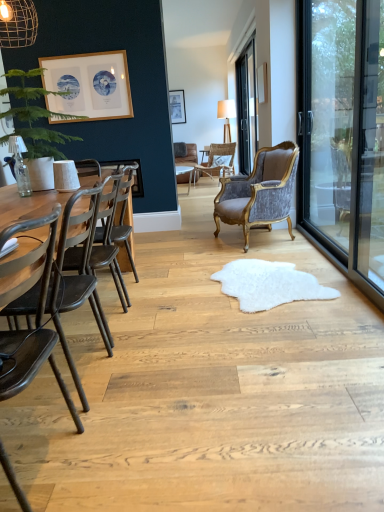
Question: Relative to matte wooden picture frame at center, the second picture frame from the right, is white fluffy rug at center in front or behind?

Choices:
 (A) behind
 (B) front

Answer: (B)

Question: Is white fluffy rug at center to the left or to the right of matte wooden picture frame at center, which appears as the 1th picture frame when viewed from the back, in the image?

Choices:
 (A) right
 (B) left

Answer: (A)

Question: Estimate the real-world distances between objects in this image. Which object is farther from the white fluffy rug at center?

Choices:
 (A) wooden textured lamp at center, the first lamp positioned from the back
 (B) dark brown wood chair at left, which is the 1th chair in front-to-back order
 (C) transparent glass screen door at right
 (D) transparent glass door at center right
 (E) clear glass bottle at left, acting as the second lamp starting from the top

Answer: (A)

Question: Which object is the farthest from the white glossy round table at center?

Choices:
 (A) dark brown wood chair at left, the fourth chair viewed from the back
 (B) transparent glass screen door at right
 (C) clear glass bottle at left, acting as the first lamp starting from the bottom
 (D) dark brown leather swivel chair at left
 (E) wooden textured lamp at center, which is the second lamp in bottom-to-top order

Answer: (A)